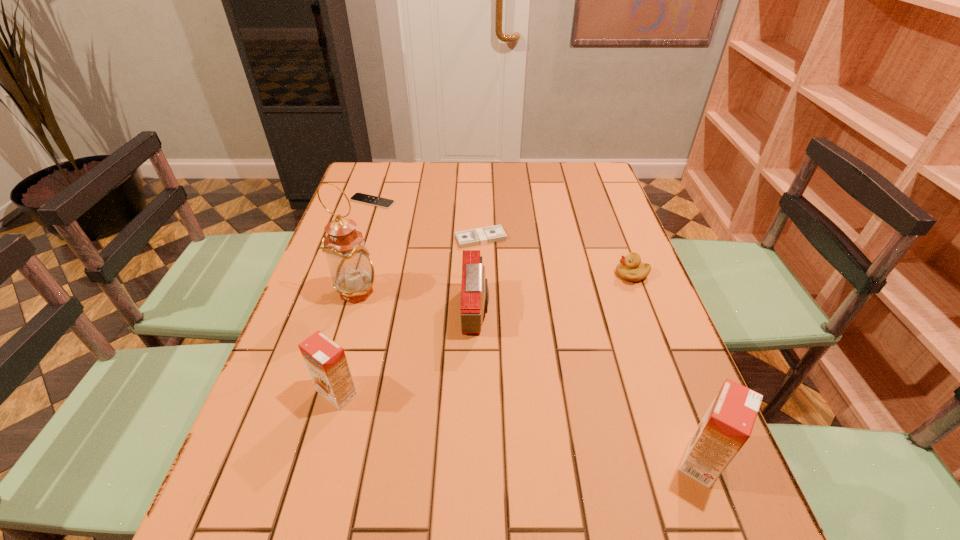
Locate an element on the screen. The image size is (960, 540). free space between the camera and the second nearest object is located at coordinates (407, 352).

Where is `free area in between the right orange juice and the farthest object`? free area in between the right orange juice and the farthest object is located at coordinates (537, 330).

In order to click on object that stands as the closest to the nearer orange juice in this screenshot , I will do `click(474, 291)`.

Locate which object ranks in proximity to the duckling. Please provide its 2D coordinates. Your answer should be formatted as a tuple, i.e. [(x, y)], where the tuple contains the x and y coordinates of a point satisfying the conditions above.

[(485, 235)]

Image resolution: width=960 pixels, height=540 pixels. In order to click on vacant space that satisfies the following two spatial constraints: 1. on the back side of the nearer orange juice; 2. on the front-facing side of the camera in this screenshot , I will do `click(644, 311)`.

Locate an element on the screen. This screenshot has height=540, width=960. vacant space that satisfies the following two spatial constraints: 1. on the front side of the second tallest object; 2. on the right side of the shorter orange juice is located at coordinates (319, 460).

Identify the location of vacant region that satisfies the following two spatial constraints: 1. on the front-facing side of the fourth shortest object; 2. on the left side of the nearest object. This screenshot has width=960, height=540. (474, 460).

Find the location of `free location that satisfies the following two spatial constraints: 1. on the front-facing side of the fourth tallest object; 2. on the front side of the second nearest object`. free location that satisfies the following two spatial constraints: 1. on the front-facing side of the fourth tallest object; 2. on the front side of the second nearest object is located at coordinates (475, 393).